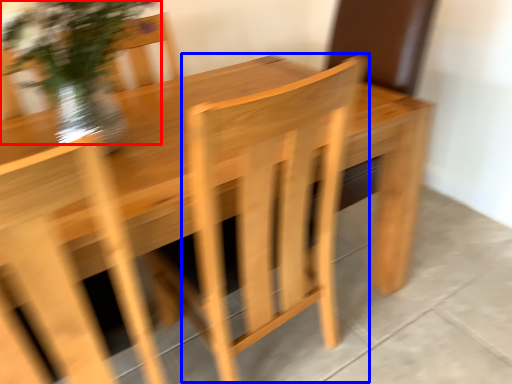
Question: Which object is further to the camera taking this photo, floral arrangement (highlighted by a red box) or armchair (highlighted by a blue box)?

Choices:
 (A) floral arrangement
 (B) armchair

Answer: (A)